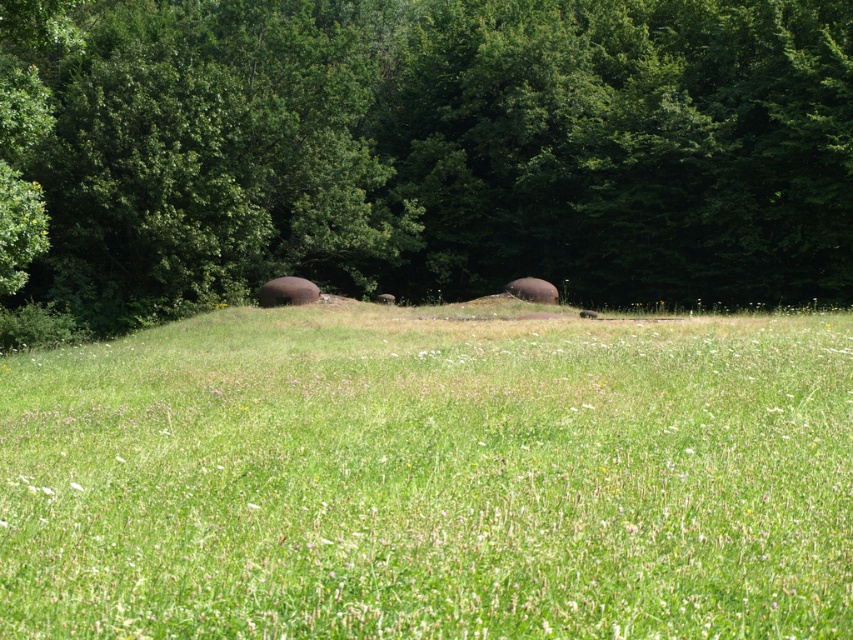
You are standing at the point marked as point (430, 477) in the image. Looking around, what is the most prominent feature you see in the grassy field?

The most prominent feature at point (430, 477) is the green grassy field at center, which is the central area of the field with lush, vibrant green grass and small wildflowers.

Based on the photo, you are a hiker trying to determine the best path through the green grassy field at center and the green leafy tree at upper center. Which object has a smaller width that might allow for easier passage?

The green grassy field at center is thinner than the green leafy tree at upper center, so the green grassy field at center has a smaller width and would allow for easier passage.